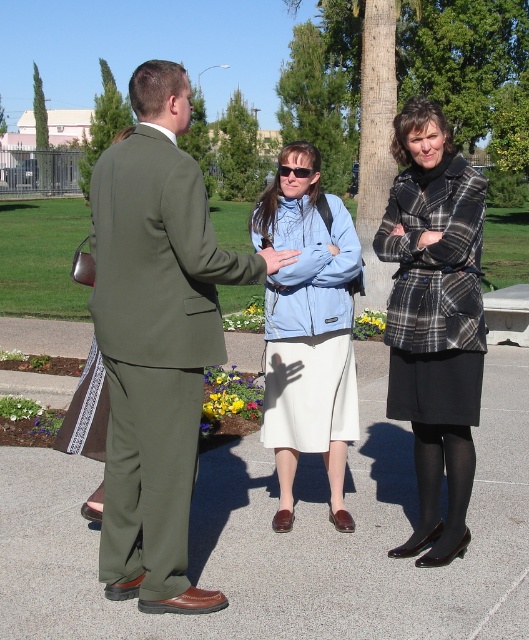
Question: Which object is the farthest from the light blue fleece jacket at center?

Choices:
 (A) olive green suit at center
 (B) plaid wool coat at center

Answer: (A)

Question: Can you confirm if olive green suit at center is positioned to the right of light blue fleece jacket at center?

Choices:
 (A) no
 (B) yes

Answer: (A)

Question: Is olive green suit at center thinner than light blue fleece jacket at center?

Choices:
 (A) no
 (B) yes

Answer: (A)

Question: Which point appears farthest from the camera in this image?

Choices:
 (A) (181, 236)
 (B) (389, 317)
 (C) (276, 314)

Answer: (C)

Question: Can you confirm if olive green suit at center is positioned above light blue fleece jacket at center?

Choices:
 (A) no
 (B) yes

Answer: (B)

Question: Based on their relative distances, which object is nearer to the plaid wool coat at center?

Choices:
 (A) olive green suit at center
 (B) light blue fleece jacket at center

Answer: (B)